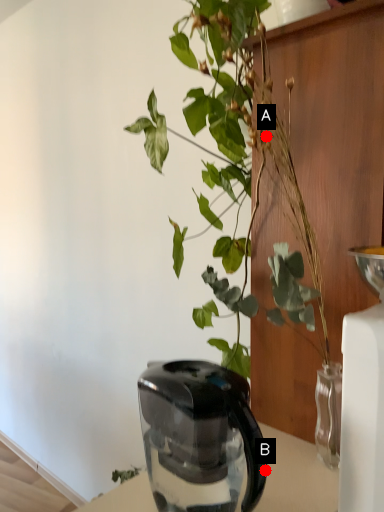
Question: Two points are circled on the image, labeled by A and B beside each circle. Which point is closer to the camera?

Choices:
 (A) A is closer
 (B) B is closer

Answer: (A)